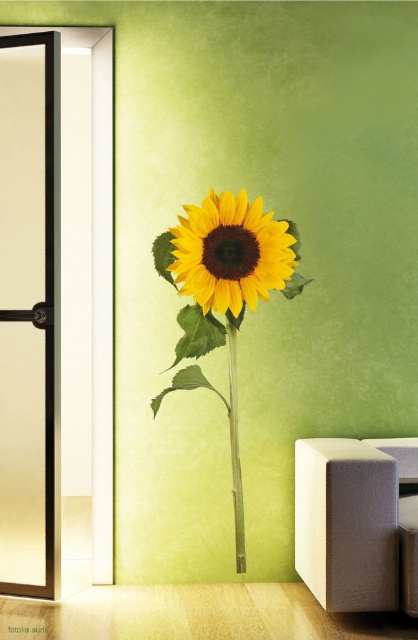
Is the position of yellow matte sunflower at center less distant than that of green bamboo stem at center?

Yes, it is.

Can you confirm if yellow matte sunflower at center is wider than green bamboo stem at center?

Yes, yellow matte sunflower at center is wider than green bamboo stem at center.

Describe the element at coordinates (231, 252) in the screenshot. I see `yellow matte sunflower at center` at that location.

Identify the location of yellow matte sunflower at center. (231, 252).